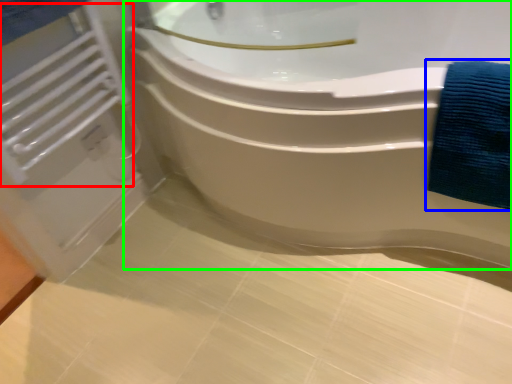
Question: Which is farther away from radiator (highlighted by a red box)? bath towel (highlighted by a blue box) or bathtub (highlighted by a green box)?

Choices:
 (A) bath towel
 (B) bathtub

Answer: (A)